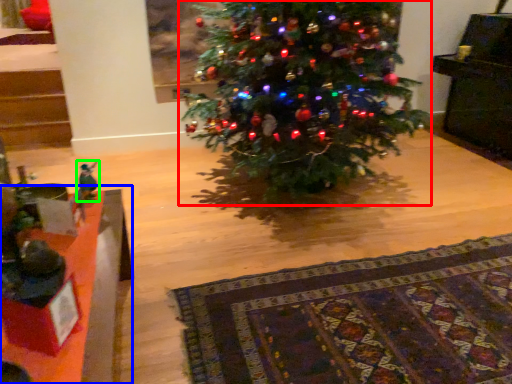
Question: Estimate the real-world distances between objects in this image. Which object is closer to christmas tree (highlighted by a red box), table (highlighted by a blue box) or toy (highlighted by a green box)?

Choices:
 (A) table
 (B) toy

Answer: (A)